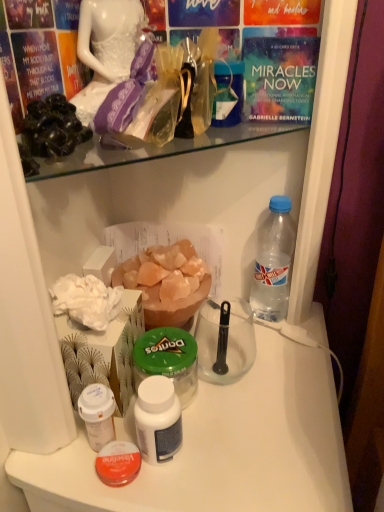
Question: Can you confirm if clear plastic bottle at right, the first bottle when ordered from right to left, is positioned to the right of black matte rock at upper left?

Choices:
 (A) no
 (B) yes

Answer: (B)

Question: From the image's perspective, is clear plastic bottle at right, which ranks as the 4th bottle in left-to-right order, above black matte rock at upper left?

Choices:
 (A) yes
 (B) no

Answer: (B)

Question: Can we say clear plastic bottle at right, which ranks as the 4th bottle in left-to-right order, lies outside black matte rock at upper left?

Choices:
 (A) yes
 (B) no

Answer: (A)

Question: From the image's perspective, would you say clear plastic bottle at right, which ranks as the 4th bottle in left-to-right order, is shown under black matte rock at upper left?

Choices:
 (A) yes
 (B) no

Answer: (A)

Question: Considering the positions of point (168, 464) and point (36, 113), is point (168, 464) closer or farther from the camera than point (36, 113)?

Choices:
 (A) closer
 (B) farther

Answer: (B)

Question: Would you say white plastic table at center is inside or outside black matte rock at upper left?

Choices:
 (A) outside
 (B) inside

Answer: (A)

Question: From a real-world perspective, is white plastic table at center above or below black matte rock at upper left?

Choices:
 (A) below
 (B) above

Answer: (A)

Question: Is white plastic table at center wider or thinner than black matte rock at upper left?

Choices:
 (A) thin
 (B) wide

Answer: (B)

Question: Relative to pink crystal salt at center, is green plastic jar at center, arranged as the 2th bottle when viewed from the right, in front or behind?

Choices:
 (A) front
 (B) behind

Answer: (A)

Question: Is green plastic jar at center, which ranks as the third bottle in left-to-right order, inside or outside of pink crystal salt at center?

Choices:
 (A) inside
 (B) outside

Answer: (B)

Question: From a real-world perspective, is green plastic jar at center, which ranks as the third bottle in left-to-right order, positioned above or below pink crystal salt at center?

Choices:
 (A) below
 (B) above

Answer: (A)

Question: Looking at the image, does green plastic jar at center, arranged as the 2th bottle when viewed from the right, seem bigger or smaller compared to pink crystal salt at center?

Choices:
 (A) small
 (B) big

Answer: (A)

Question: From a real-world perspective, relative to white plastic bottle at center, which is the second bottle from left to right, is pink crystal salt at center vertically above or below?

Choices:
 (A) below
 (B) above

Answer: (B)

Question: Is pink crystal salt at center bigger or smaller than white plastic bottle at center, which is the second bottle from left to right?

Choices:
 (A) big
 (B) small

Answer: (A)